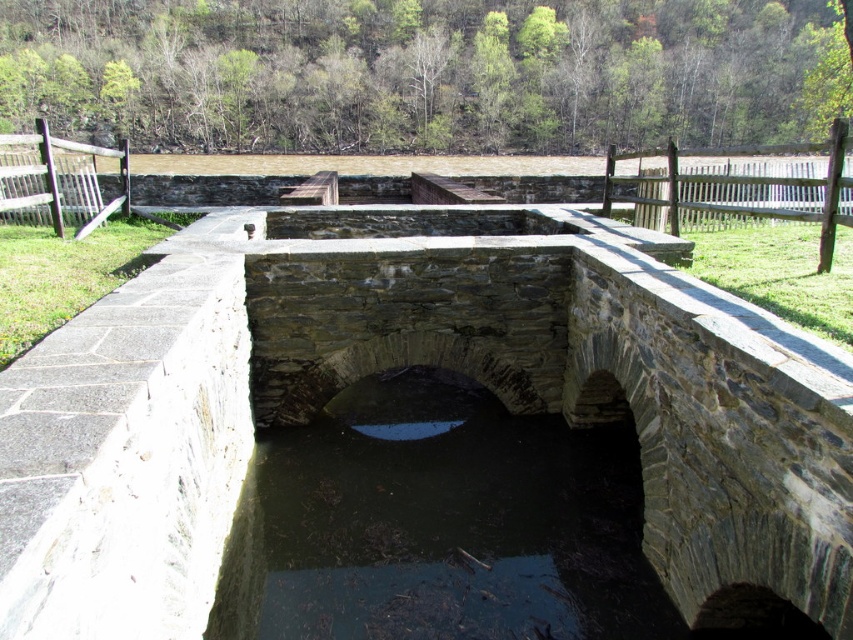
Does gray stone bridge at center have a greater width compared to dark stone water at center?

Indeed, gray stone bridge at center has a greater width compared to dark stone water at center.

Does point (737, 509) come in front of point (218, 611)?

That is True.

You are a GUI agent. You are given a task and a screenshot of the screen. Output one action in this format:
    pyautogui.click(x=<x>, y=<y>)
    Task: Click on the gray stone bridge at center
    The height and width of the screenshot is (640, 853).
    Given the screenshot: What is the action you would take?
    pyautogui.click(x=412, y=364)